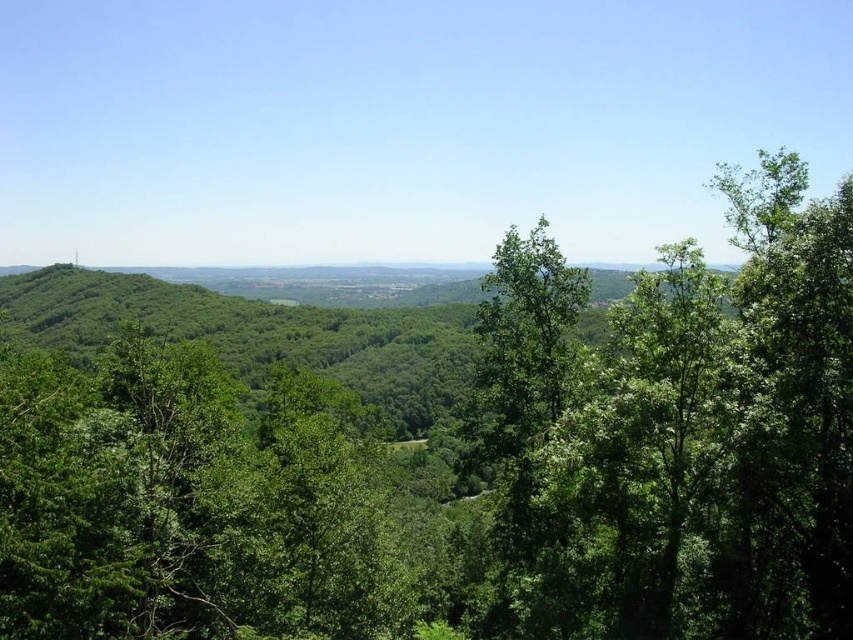
Is green leafy tree at upper right closer to the viewer compared to green leafy tree at center?

No, green leafy tree at upper right is behind green leafy tree at center.

Which is above, green leafy tree at upper right or green leafy tree at center?

green leafy tree at upper right is higher up.

Which is in front, point (651, 449) or point (138, 372)?

Positioned in front is point (651, 449).

You are a GUI agent. You are given a task and a screenshot of the screen. Output one action in this format:
    pyautogui.click(x=<x>, y=<y>)
    Task: Click on the green leafy tree at upper right
    
    Given the screenshot: What is the action you would take?
    pyautogui.click(x=701, y=445)